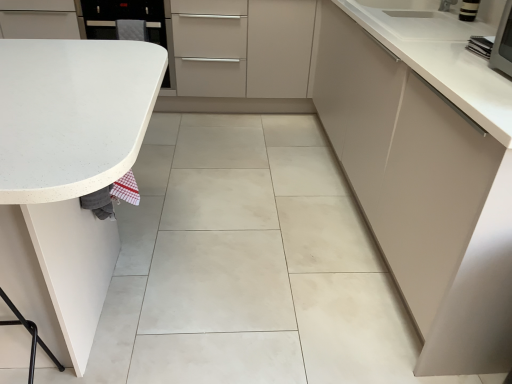
Describe the element at coordinates (123, 18) in the screenshot. This screenshot has height=384, width=512. I see `white glossy oven at upper left` at that location.

What do you see at coordinates (67, 175) in the screenshot? The image size is (512, 384). I see `white speckled laminate countertop at left, marked as the first countertop in a left-to-right arrangement` at bounding box center [67, 175].

Measure the distance between point [398,279] and camera.

Point [398,279] is 5.33 feet from camera.

Locate an element on the screen. white glossy oven at upper left is located at coordinates (123, 18).

You are a GUI agent. You are given a task and a screenshot of the screen. Output one action in this format:
    pyautogui.click(x=<x>, y=<y>)
    Task: Click on the countertop directly beneath the white glossy oven at upper left (from a real-world perspective)
    Image resolution: width=512 pixels, height=384 pixels.
    Given the screenshot: What is the action you would take?
    pyautogui.click(x=67, y=175)

Considering the sizes of objects white speckled laminate countertop at left, arranged as the second countertop when viewed from the top, and white glossy oven at upper left in the image provided, who is bigger, white speckled laminate countertop at left, arranged as the second countertop when viewed from the top, or white glossy oven at upper left?

Bigger between the two is white speckled laminate countertop at left, arranged as the second countertop when viewed from the top.

Would you consider white speckled laminate countertop at left, which ranks as the second countertop in right-to-left order, to be distant from white glossy oven at upper left?

Yes.

Is white speckled laminate countertop at left, which ranks as the second countertop in right-to-left order, taller than white glossy oven at upper left?

Yes.

Considering the relative sizes of white speckled laminate countertop at left, which ranks as the second countertop in right-to-left order, and matte white cabinet at right in the image provided, is white speckled laminate countertop at left, which ranks as the second countertop in right-to-left order, smaller than matte white cabinet at right?

Yes, white speckled laminate countertop at left, which ranks as the second countertop in right-to-left order, is smaller than matte white cabinet at right.

Does white speckled laminate countertop at left, the first countertop when ordered from bottom to top, have a greater width compared to matte white cabinet at right?

Yes.

From a real-world perspective, which object rests below the other?

white speckled laminate countertop at left, the first countertop when ordered from bottom to top, is physically lower.

Considering the positions of objects matte white cabinet at right and white speckled laminate countertop at left, which ranks as the second countertop in right-to-left order, in the image provided, who is behind, matte white cabinet at right or white speckled laminate countertop at left, which ranks as the second countertop in right-to-left order,?

matte white cabinet at right.

Can you confirm if matte white cabinet at right is shorter than white speckled laminate countertop at left, the first countertop when ordered from bottom to top?

No, matte white cabinet at right is not shorter than white speckled laminate countertop at left, the first countertop when ordered from bottom to top.

Between point (367, 49) and point (54, 72), which one is positioned behind?

Point (367, 49)

Would you consider matte white cabinet at right to be distant from white speckled laminate countertop at left, marked as the first countertop in a left-to-right arrangement?

Yes, matte white cabinet at right is far from white speckled laminate countertop at left, marked as the first countertop in a left-to-right arrangement.

Do you think white glossy countertop at upper right, the second countertop when ordered from left to right, is within white glossy oven at upper left, or outside of it?

white glossy countertop at upper right, the second countertop when ordered from left to right, cannot be found inside white glossy oven at upper left.

Does white glossy countertop at upper right, the second countertop when ordered from left to right, touch white glossy oven at upper left?

No, white glossy countertop at upper right, the second countertop when ordered from left to right, is not next to white glossy oven at upper left.

Is white glossy countertop at upper right, the first countertop from the top, bigger than white glossy oven at upper left?

No.

This screenshot has width=512, height=384. In the image, there is a white glossy countertop at upper right, marked as the second countertop in a bottom-to-top arrangement. Find the location of `appliance below it (from a real-world perspective)`. appliance below it (from a real-world perspective) is located at coordinates (123, 18).

From the image's perspective, between white glossy oven at upper left and matte white cabinet at right, who is located below?

matte white cabinet at right appears lower in the image.

Is white glossy oven at upper left further to the viewer compared to matte white cabinet at right?

Yes, it is.

Is white glossy oven at upper left facing away from matte white cabinet at right?

No, white glossy oven at upper left is not facing the opposite direction of matte white cabinet at right.

Is point (103, 16) closer to viewer compared to point (447, 291)?

No, (103, 16) is behind (447, 291).

Can you confirm if white glossy oven at upper left is wider than white glossy countertop at upper right, the second countertop when ordered from left to right?

Correct, the width of white glossy oven at upper left exceeds that of white glossy countertop at upper right, the second countertop when ordered from left to right.

Between white glossy oven at upper left and white glossy countertop at upper right, marked as the second countertop in a bottom-to-top arrangement, which one has larger size?

Bigger between the two is white glossy oven at upper left.

Is point (151, 4) closer to viewer compared to point (434, 45)?

No, (151, 4) is further to viewer.

Considering their positions, is white glossy oven at upper left located in front of or behind white glossy countertop at upper right, the first countertop from the top?

Visually, white glossy oven at upper left is located behind white glossy countertop at upper right, the first countertop from the top.

Is white speckled laminate countertop at left, the first countertop when ordered from bottom to top, not close to white glossy countertop at upper right, the first countertop from the top?

white speckled laminate countertop at left, the first countertop when ordered from bottom to top, is far away from white glossy countertop at upper right, the first countertop from the top.

Which is correct: white speckled laminate countertop at left, which ranks as the second countertop in right-to-left order, is inside white glossy countertop at upper right, the second countertop when ordered from left to right, or outside of it?

white speckled laminate countertop at left, which ranks as the second countertop in right-to-left order, is spatially situated outside white glossy countertop at upper right, the second countertop when ordered from left to right.

Does white speckled laminate countertop at left, the first countertop when ordered from bottom to top, have a greater width compared to white glossy countertop at upper right, marked as the second countertop in a bottom-to-top arrangement?

Correct, the width of white speckled laminate countertop at left, the first countertop when ordered from bottom to top, exceeds that of white glossy countertop at upper right, marked as the second countertop in a bottom-to-top arrangement.

In the image, there is a white speckled laminate countertop at left, arranged as the second countertop when viewed from the top. Identify the location of appliance above it (from the image's perspective). (123, 18).

At what (x,y) coordinates should I click in order to perform the action: click on cabinetry lying on the right of white speckled laminate countertop at left, which ranks as the second countertop in right-to-left order. Please return your answer as a coordinate pair (x, y). Looking at the image, I should click on (426, 167).

In the scene shown: Which object lies further to the anchor point white glossy countertop at upper right, the second countertop when ordered from left to right, matte white cabinet at right or white glossy oven at upper left?

Among the two, white glossy oven at upper left is located further to white glossy countertop at upper right, the second countertop when ordered from left to right.

From the image, which object appears to be farther from matte white cabinet at right, white glossy oven at upper left or white glossy countertop at upper right, marked as the second countertop in a bottom-to-top arrangement?

white glossy oven at upper left lies further to matte white cabinet at right than the other object.

When comparing their distances from matte white cabinet at right, does white glossy countertop at upper right, the first countertop from the top, or white glossy oven at upper left seem further?

white glossy oven at upper left.

Based on their spatial positions, is white glossy countertop at upper right, the second countertop when ordered from left to right, or matte white cabinet at right further from white glossy oven at upper left?

matte white cabinet at right.

Which object lies nearer to the anchor point matte white cabinet at right, white speckled laminate countertop at left, marked as the first countertop in a left-to-right arrangement, or white glossy countertop at upper right, the second countertop when ordered from left to right?

Among the two, white glossy countertop at upper right, the second countertop when ordered from left to right, is located nearer to matte white cabinet at right.

Estimate the real-world distances between objects in this image. Which object is closer to white glossy oven at upper left, white speckled laminate countertop at left, the first countertop when ordered from bottom to top, or white glossy countertop at upper right, marked as the second countertop in a bottom-to-top arrangement?

Among the two, white glossy countertop at upper right, marked as the second countertop in a bottom-to-top arrangement, is located nearer to white glossy oven at upper left.

Based on their spatial positions, is white glossy countertop at upper right, the first countertop from the top, or white speckled laminate countertop at left, the first countertop when ordered from bottom to top, closer to white glossy oven at upper left?

Among the two, white glossy countertop at upper right, the first countertop from the top, is located nearer to white glossy oven at upper left.

Estimate the real-world distances between objects in this image. Which object is closer to white glossy oven at upper left, white speckled laminate countertop at left, the first countertop when ordered from bottom to top, or matte white cabinet at right?

The object closer to white glossy oven at upper left is white speckled laminate countertop at left, the first countertop when ordered from bottom to top.

In order to click on cabinetry between white glossy oven at upper left and white glossy countertop at upper right, which ranks as the 1th countertop in right-to-left order, from left to right in this screenshot , I will do `click(426, 167)`.

I want to click on cabinetry between white speckled laminate countertop at left, which ranks as the second countertop in right-to-left order, and white glossy oven at upper left in the front-back direction, so click(426, 167).

Identify the location of countertop located between white speckled laminate countertop at left, arranged as the second countertop when viewed from the top, and white glossy oven at upper left in the depth direction. (441, 56).

Image resolution: width=512 pixels, height=384 pixels. Identify the location of cabinetry located between white speckled laminate countertop at left, which ranks as the second countertop in right-to-left order, and white glossy countertop at upper right, marked as the second countertop in a bottom-to-top arrangement, in the left-right direction. (426, 167).